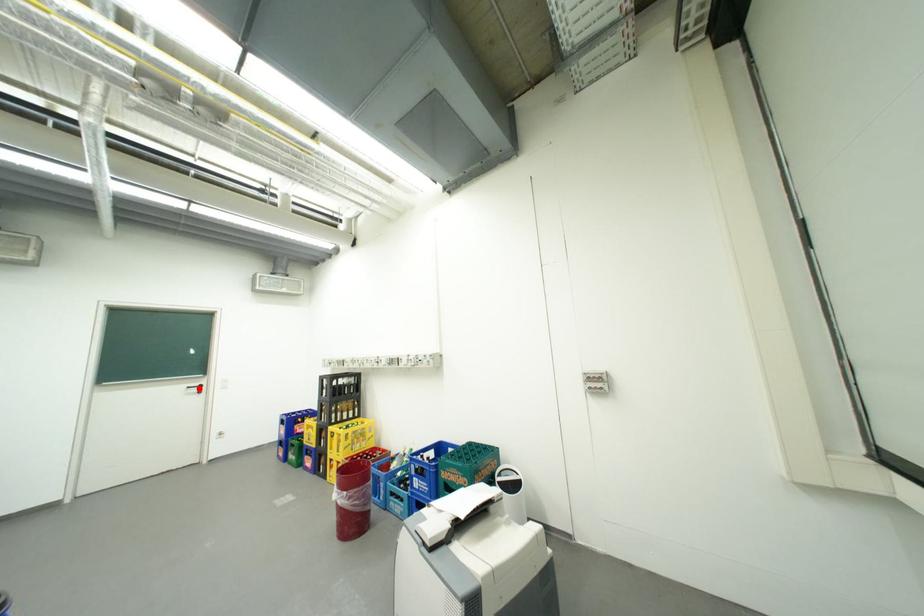
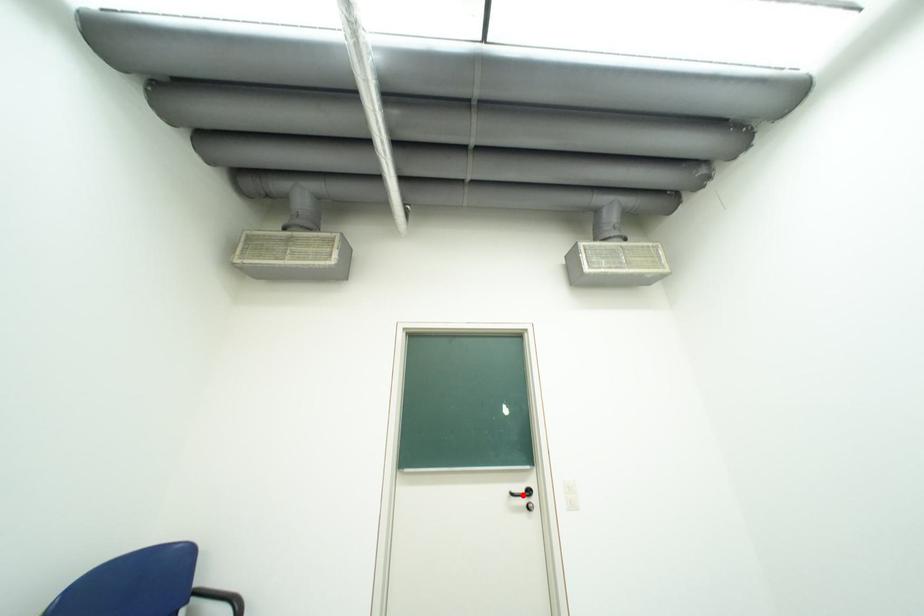
I am providing you with two images of the same scene from different viewpoints. A red point is marked on the first image and another point is marked on the second image. Does the point marked in image1 correspond to the same location as the one in image2?

Yes